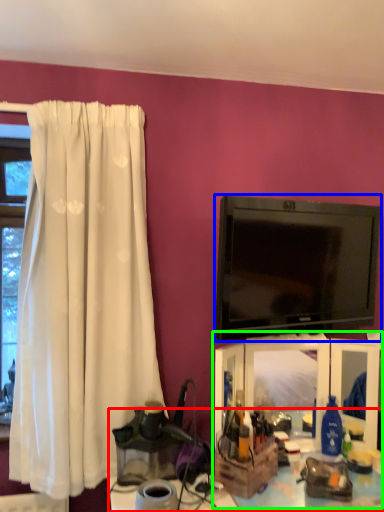
Question: Which is nearer to the table (highlighted by a red box)? television (highlighted by a blue box) or entertainment center (highlighted by a green box).

Choices:
 (A) television
 (B) entertainment center

Answer: (B)